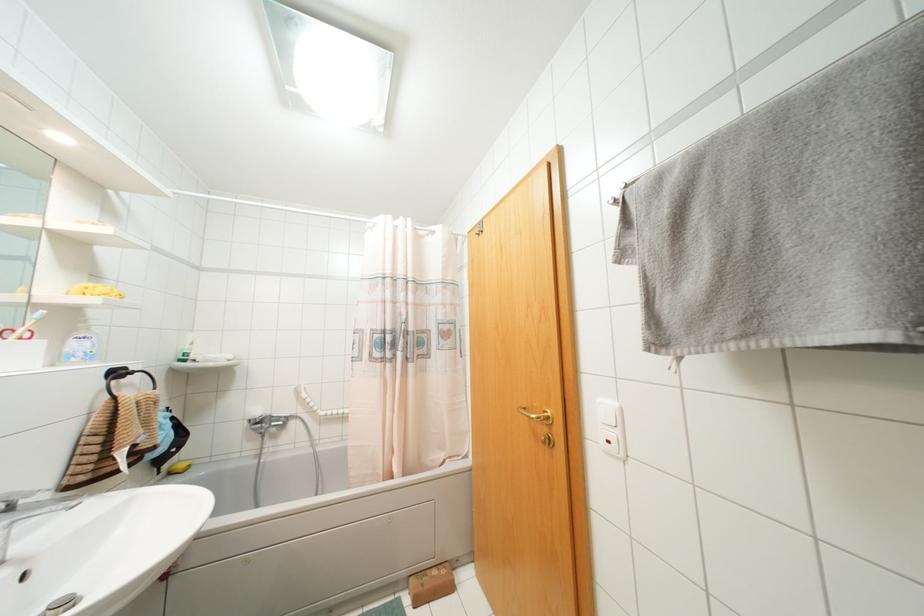
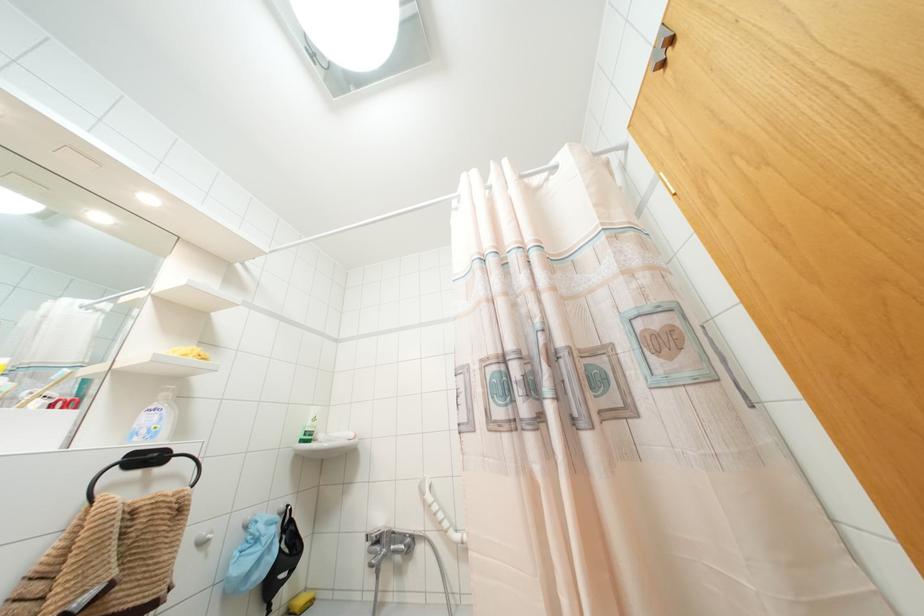
Find the pixel in the second image that matches point 271,421 in the first image.

(390, 541)